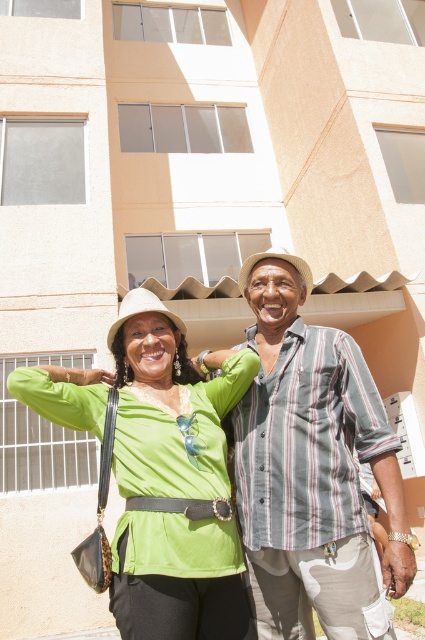
You are trying to identify two shirts hanging on a rack in the image. The shirts are labeled as striped cotton shirt at center and green matte shirt at center. Which shirt is positioned to the right of the other?

The striped cotton shirt at center is positioned to the right of the green matte shirt at center.

You are standing in front of the building and want to take a photo of the striped cotton shirt at center. Where should you position yourself to ensure the shirt is in the frame?

The striped cotton shirt at center is located at point (x=312, y=468), so you should position yourself directly in front of the building at the center to capture it in the frame.

You are a photographer trying to capture both the striped cotton shirt at center and the green matte shirt at center in the same frame. Given that your camera has a minimum focus distance of 12 inches, will you be able to focus on both shirts simultaneously?

The striped cotton shirt at center is 12.39 inches away from the green matte shirt at center. Since the distance between them is slightly more than the camera minimum focus distance of 12 inches, the camera can focus on both shirts simultaneously as they are within the required range.